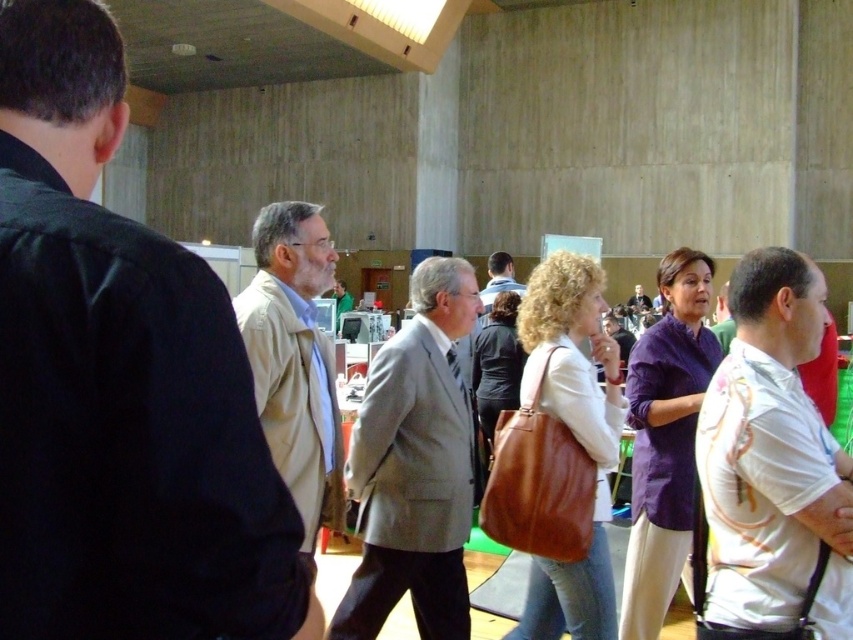
Based on the photo, is light gray suit at center above beige fabric jacket at center?

Incorrect, light gray suit at center is not positioned above beige fabric jacket at center.

The image size is (853, 640). Describe the element at coordinates (415, 467) in the screenshot. I see `light gray suit at center` at that location.

Where is `light gray suit at center`? The image size is (853, 640). light gray suit at center is located at coordinates (415, 467).

Is light beige suit at center taller than white printed shirt at center?

No, light beige suit at center is not taller than white printed shirt at center.

Who is more forward, (209, 493) or (775, 637)?

Point (209, 493)

Is point (103, 561) in front of point (735, 280)?

Yes, point (103, 561) is in front of point (735, 280).

I want to click on light beige suit at center, so click(x=119, y=384).

Between white printed shirt at center and light gray suit at center, which one has less height?

Standing shorter between the two is white printed shirt at center.

Is white printed shirt at center wider than light gray suit at center?

No, white printed shirt at center is not wider than light gray suit at center.

Who is more distant from viewer, (759, 522) or (373, 566)?

Point (373, 566)

Locate an element on the screen. white printed shirt at center is located at coordinates (772, 467).